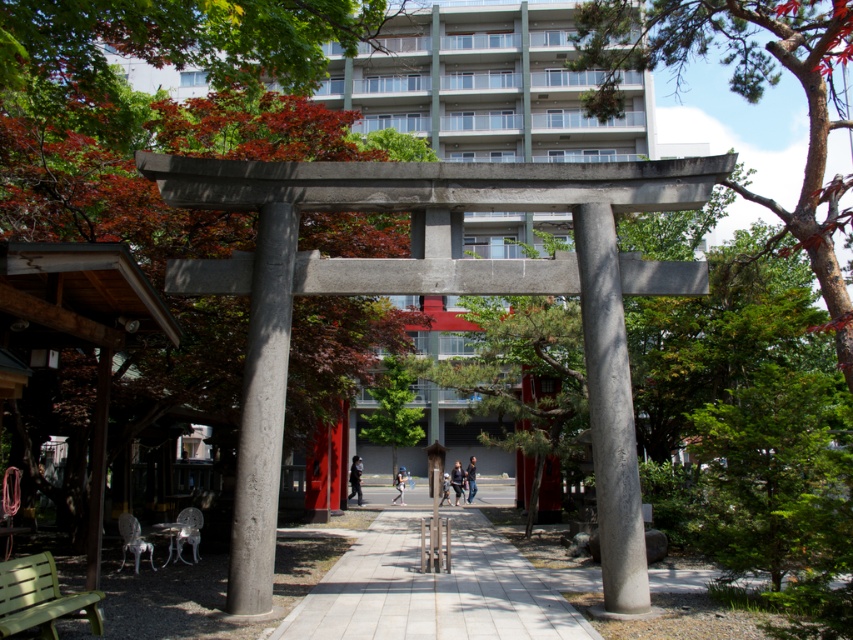
Question: Among these objects, which one is nearest to the camera?

Choices:
 (A) dark gray concrete statue at center
 (B) light blue fabric at center
 (C) light gray fabric jacket at center
 (D) gray concrete pillar at center

Answer: (D)

Question: Based on their relative distances, which object is farther from the light gray fabric jacket at center?

Choices:
 (A) dark gray fabric jacket at center
 (B) light blue fabric at center

Answer: (A)

Question: Does dark blue jeans at center have a larger size compared to light blue fabric at center?

Choices:
 (A) no
 (B) yes

Answer: (A)

Question: Is dark gray concrete statue at center further to the viewer compared to dark blue jeans at center?

Choices:
 (A) no
 (B) yes

Answer: (A)

Question: Which point is closer to the camera?

Choices:
 (A) dark blue jeans at center
 (B) gray concrete pillar at center
 (C) white stone path at center
 (D) dark gray fabric jacket at center

Answer: (C)

Question: Can you confirm if green textured bark at upper right is positioned above light gray fabric jacket at center?

Choices:
 (A) yes
 (B) no

Answer: (A)